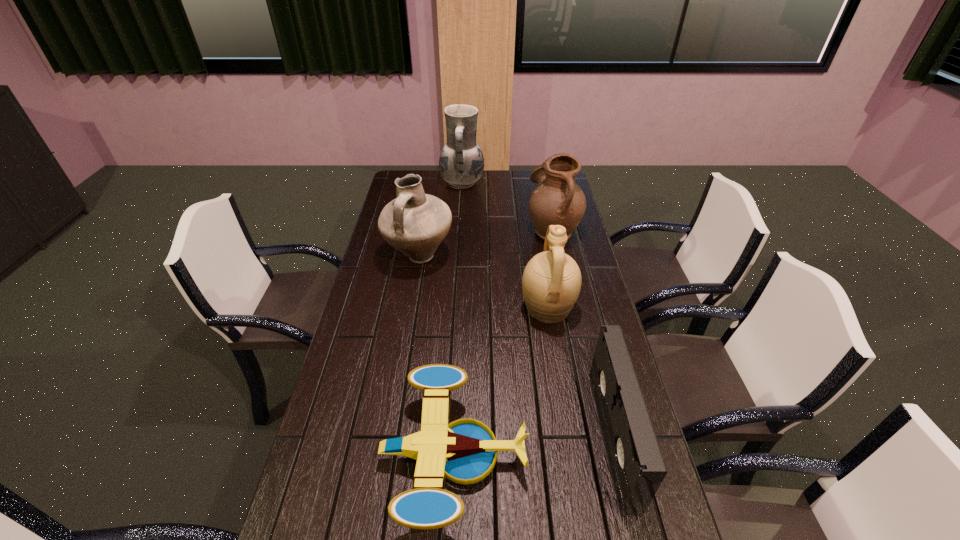
The height and width of the screenshot is (540, 960). In order to click on free point that satisfies the following two spatial constraints: 1. on the front-facing side of the farthest object; 2. on the left side of the fourth farthest object in this screenshot , I will do `click(454, 308)`.